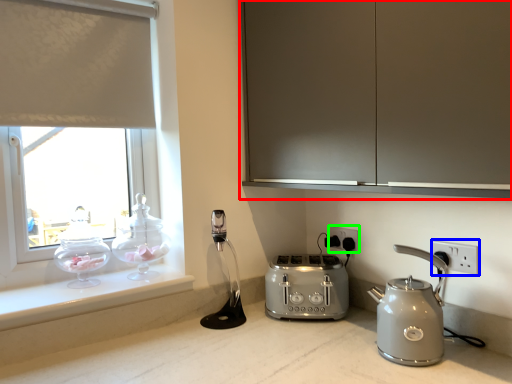
Question: Considering the real-world distances, which object is farthest from cabinetry (highlighted by a red box)? electric outlet (highlighted by a blue box) or electric outlet (highlighted by a green box)?

Choices:
 (A) electric outlet
 (B) electric outlet

Answer: (B)